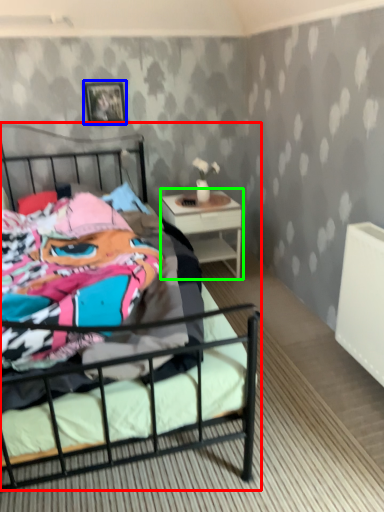
Question: Which object is the farthest from bed (highlighted by a red box)? Choose among these: picture frame (highlighted by a blue box) or nightstand (highlighted by a green box).

Choices:
 (A) picture frame
 (B) nightstand

Answer: (A)